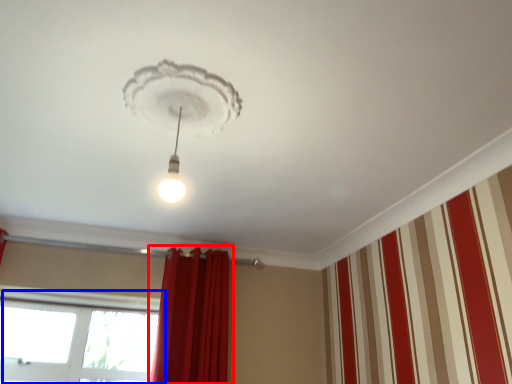
Question: Which of the following is the farthest to the observer, curtain (highlighted by a red box) or window (highlighted by a blue box)?

Choices:
 (A) curtain
 (B) window

Answer: (B)